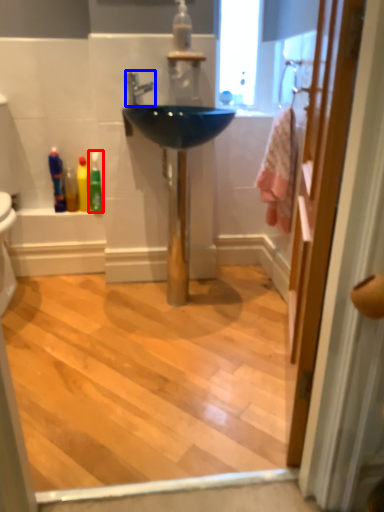
Question: Which object appears farthest to the camera in this image, toiletry (highlighted by a red box) or tap (highlighted by a blue box)?

Choices:
 (A) toiletry
 (B) tap

Answer: (A)